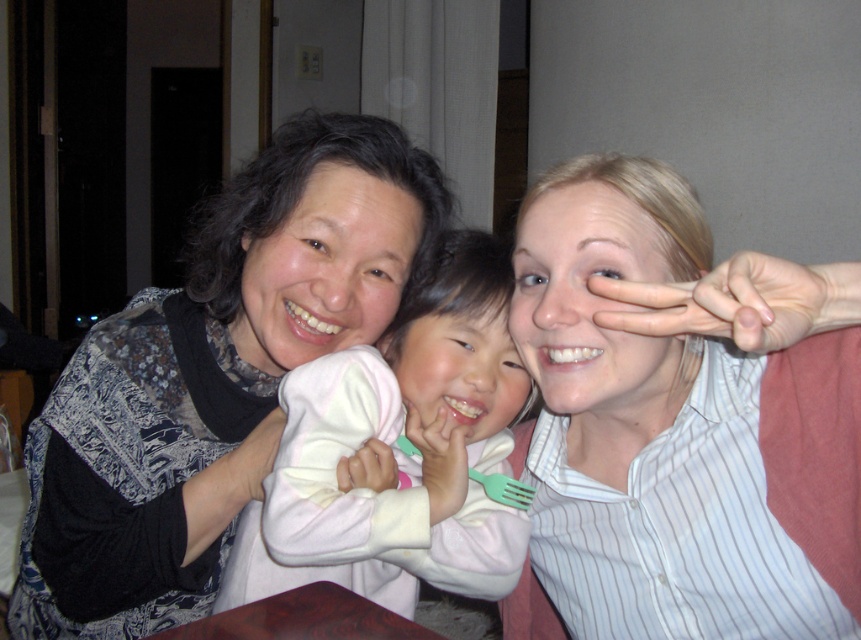
Question: Which point appears closest to the camera in this image?

Choices:
 (A) (471, 476)
 (B) (242, 333)
 (C) (832, 595)
 (D) (482, 330)

Answer: (C)

Question: Among these points, which one is nearest to the camera?

Choices:
 (A) (853, 445)
 (B) (85, 500)
 (C) (472, 474)
 (D) (459, 557)

Answer: (A)

Question: Does soft pink fabric at center appear on the left side of green plastic fork at center?

Choices:
 (A) no
 (B) yes

Answer: (B)

Question: Is blonde hair at right bigger than matte black sweater at left?

Choices:
 (A) no
 (B) yes

Answer: (A)

Question: Is blonde hair at right to the left of soft pink fabric at center from the viewer's perspective?

Choices:
 (A) no
 (B) yes

Answer: (A)

Question: Which point is farther to the camera?

Choices:
 (A) green plastic fork at center
 (B) soft pink fabric at center
 (C) blonde hair at right
 (D) matte black sweater at left

Answer: (A)